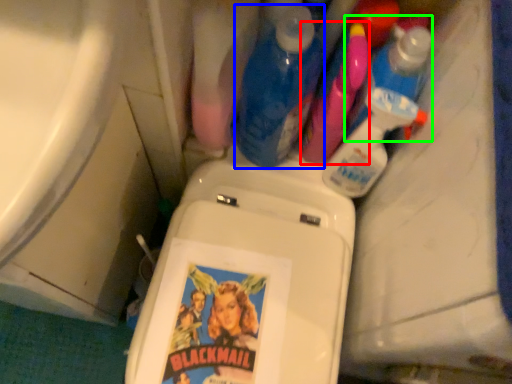
Question: Which object is the closest to the cleaning product (highlighted by a red box)? Choose among these: cleaning product (highlighted by a blue box) or cleaning product (highlighted by a green box).

Choices:
 (A) cleaning product
 (B) cleaning product

Answer: (B)